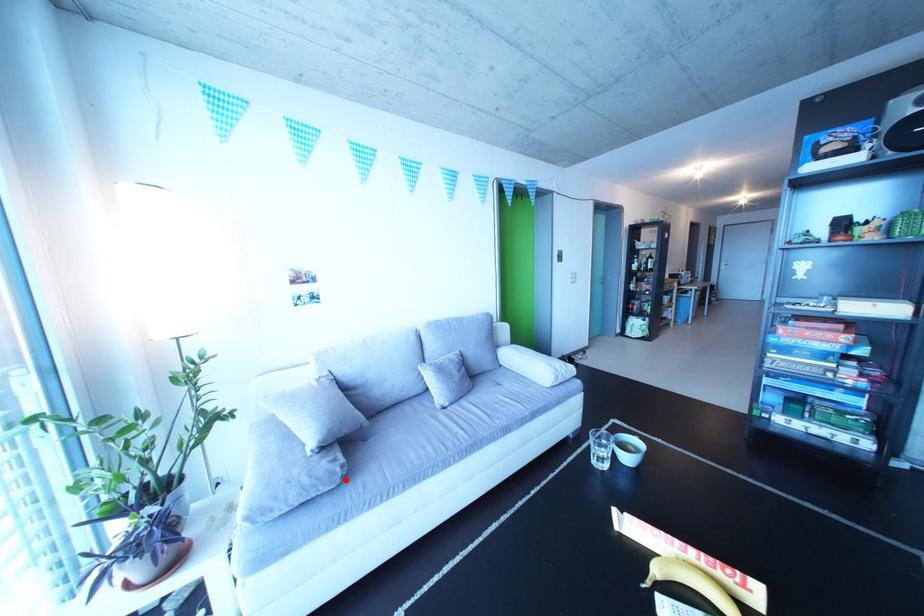
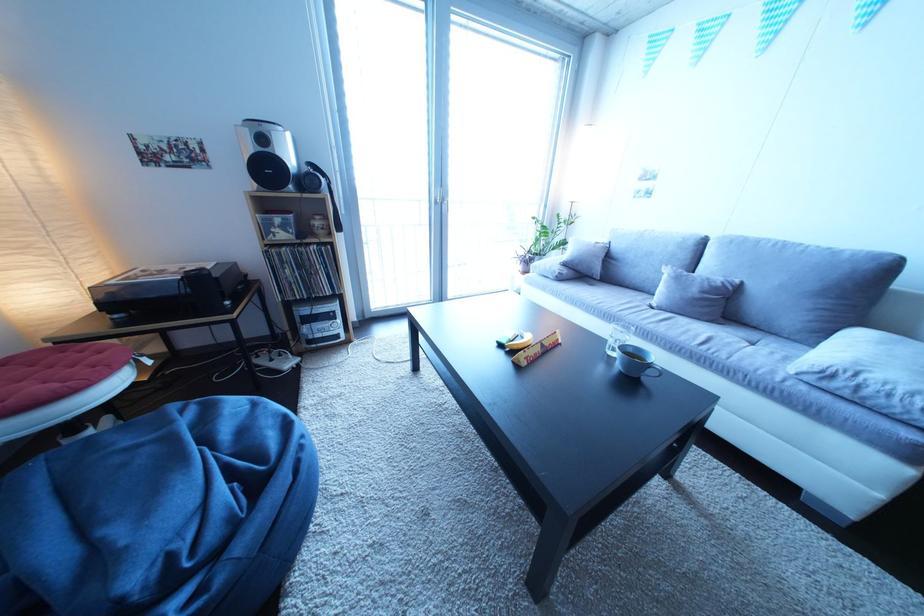
Locate, in the second image, the point that corresponds to the highlighted location in the first image.

(567, 278)